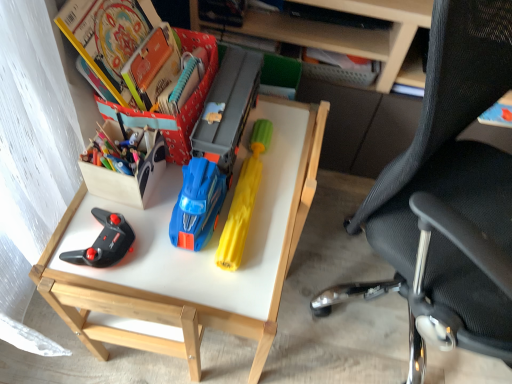
Find the location of a particular element. The height and width of the screenshot is (384, 512). free space in front of yellow rubber toy at center is located at coordinates (242, 254).